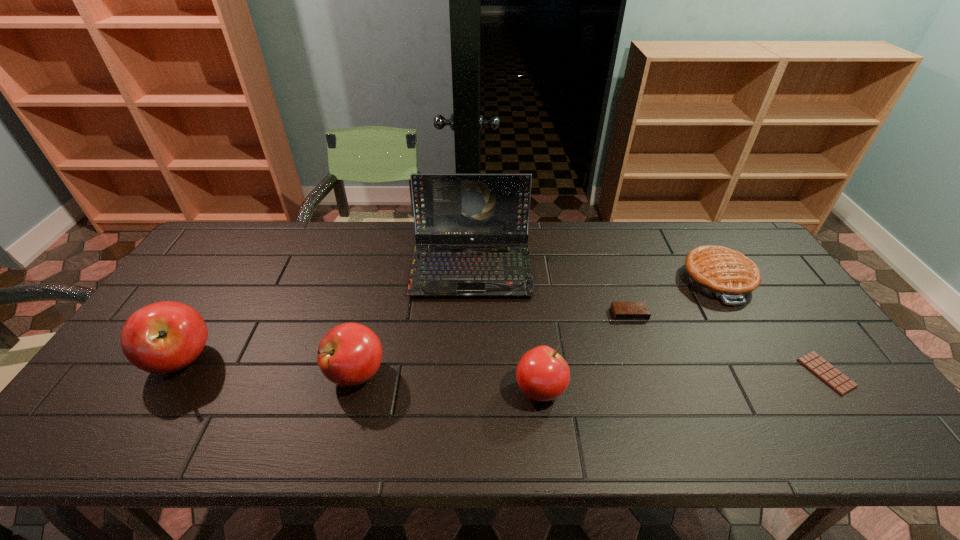
Where is `free space located on the back of the leftmost object`? The height and width of the screenshot is (540, 960). free space located on the back of the leftmost object is located at coordinates (252, 247).

Identify the location of free point located 0.340m on the left of the second object from left to right. (190, 374).

At what (x,y) coordinates should I click in order to perform the action: click on free space located on the back of the rightmost apple. Please return your answer as a coordinate pair (x, y). Image resolution: width=960 pixels, height=540 pixels. Looking at the image, I should click on (526, 268).

Where is `vacant area located 0.260m on the front face of the fifth object from left to right`? This screenshot has width=960, height=540. vacant area located 0.260m on the front face of the fifth object from left to right is located at coordinates (660, 401).

You are a GUI agent. You are given a task and a screenshot of the screen. Output one action in this format:
    pyautogui.click(x=<x>, y=<y>)
    Task: Click on the vacant space located on the screen of the tallest object
    The height and width of the screenshot is (540, 960).
    Given the screenshot: What is the action you would take?
    pyautogui.click(x=468, y=397)

Where is `vacant space located on the front of the pie`? Image resolution: width=960 pixels, height=540 pixels. vacant space located on the front of the pie is located at coordinates (784, 392).

Locate an element on the screen. Image resolution: width=960 pixels, height=540 pixels. vacant space situated on the back of the shortest object is located at coordinates tap(791, 323).

Image resolution: width=960 pixels, height=540 pixels. What are the coordinates of `laptop computer present at the far edge` in the screenshot? It's located at (449, 208).

The width and height of the screenshot is (960, 540). Identify the location of pie that is positioned at the far edge. (719, 272).

Locate an element on the screen. This screenshot has height=540, width=960. candy bar located at the near edge is located at coordinates (839, 382).